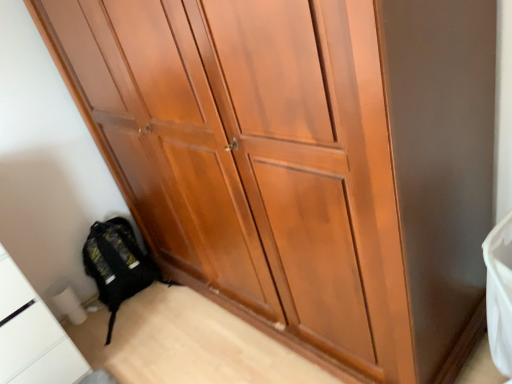
Locate an element on the screen. This screenshot has width=512, height=384. blank area beneath black fabric backpack at lower left (from a real-world perspective) is located at coordinates (133, 306).